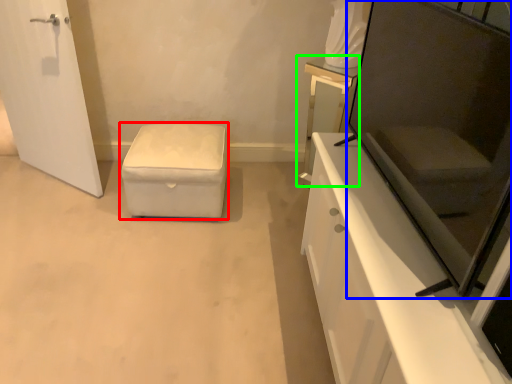
Question: Which object is positioned closest to furniture (highlighted by a red box)? Select from screen door (highlighted by a blue box) and vanity (highlighted by a green box).

Choices:
 (A) screen door
 (B) vanity

Answer: (B)